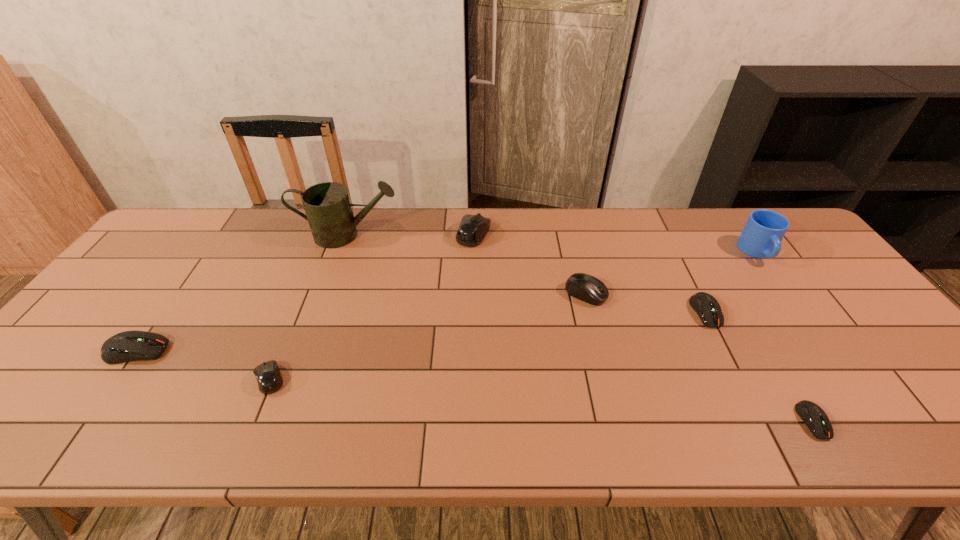
Image resolution: width=960 pixels, height=540 pixels. I want to click on the second smallest dark computer equipment, so click(x=708, y=309).

Where is `the fifth computer equipment from left to right`? The image size is (960, 540). the fifth computer equipment from left to right is located at coordinates (708, 309).

Image resolution: width=960 pixels, height=540 pixels. I want to click on the nearest black mouse, so click(x=269, y=379).

The image size is (960, 540). Find the location of `the smallest black mouse`. the smallest black mouse is located at coordinates (269, 379).

Find the location of `the smallest dark computer equipment`. the smallest dark computer equipment is located at coordinates (815, 418).

Identify the location of the rightmost computer equipment. (815, 418).

I want to click on vacant region located 0.100m with the spout on the tallest object, so click(432, 235).

The width and height of the screenshot is (960, 540). In order to click on free spot located 0.330m on the side of the mug with the handle in this screenshot , I will do `click(835, 360)`.

Where is `vacant space located on the right of the fifth object from right to left`? vacant space located on the right of the fifth object from right to left is located at coordinates [525, 234].

Find the location of a particular element. The image size is (960, 540). vacant space located on the back of the fifth object from left to right is located at coordinates (567, 220).